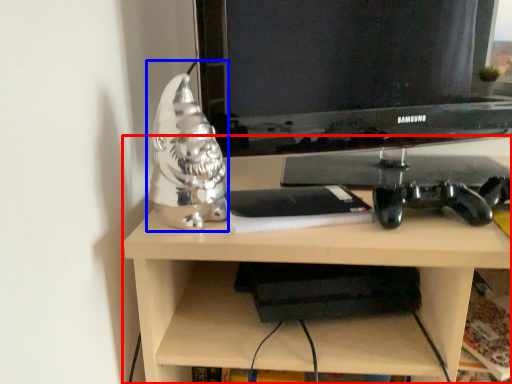
Question: Among these objects, which one is farthest to the camera, desk (highlighted by a red box) or figurine (highlighted by a blue box)?

Choices:
 (A) desk
 (B) figurine

Answer: (B)